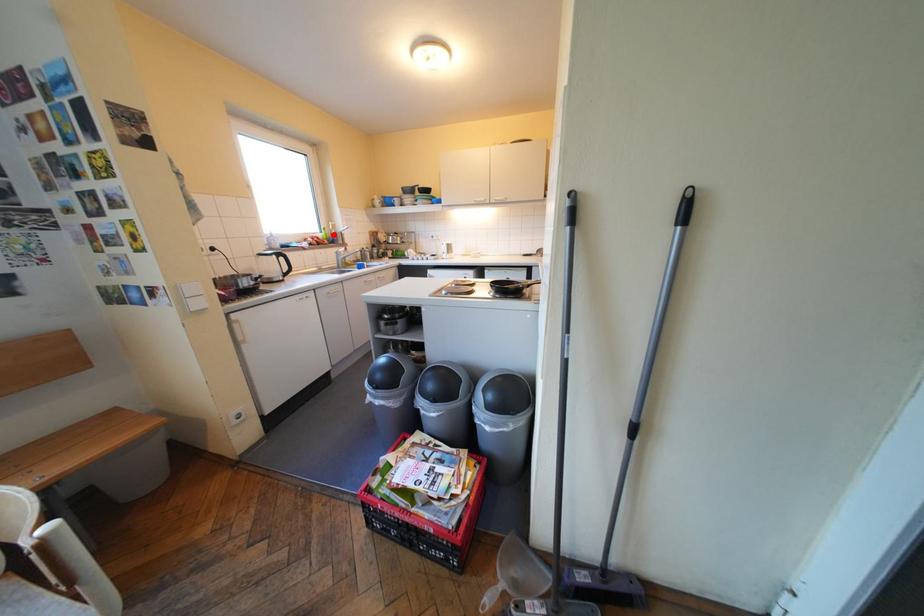
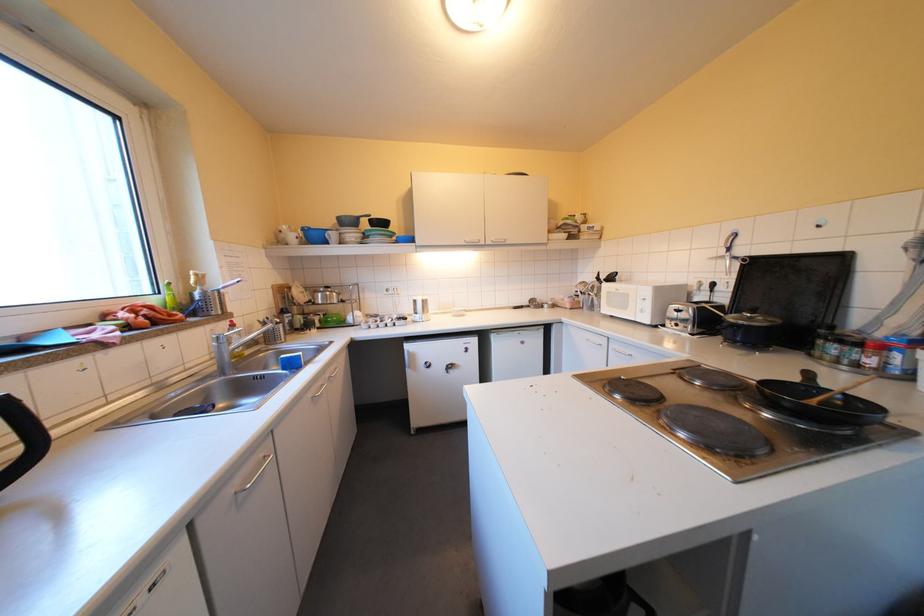
Question: I am providing you with two images of the same scene from different viewpoints. In image1, a red point is highlighted. Considering the same 3D point in image2, which of the following is correct?

Choices:
 (A) It is closer
 (B) It is farther

Answer: (B)